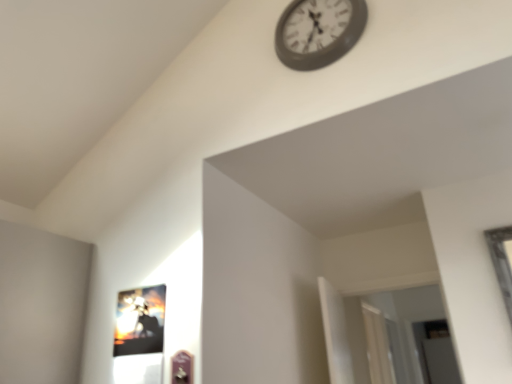
The height and width of the screenshot is (384, 512). What do you see at coordinates (140, 321) in the screenshot?
I see `metallic glossy picture frame at lower left` at bounding box center [140, 321].

At what (x,y) coordinates should I click in order to perform the action: click on metallic glossy picture frame at lower left. Please return your answer as a coordinate pair (x, y). Looking at the image, I should click on (140, 321).

Locate an element on the screen. This screenshot has height=384, width=512. metallic gray clock at upper center is located at coordinates (318, 32).

What do you see at coordinates (318, 32) in the screenshot?
I see `metallic gray clock at upper center` at bounding box center [318, 32].

From the picture: In order to face metallic gray clock at upper center, should I rotate leftwards or rightwards?

Rotate right and turn 8.149 degrees.

Find the location of a particular element. metallic glossy picture frame at lower left is located at coordinates (140, 321).

Which is more to the left, metallic glossy picture frame at lower left or metallic gray clock at upper center?

From the viewer's perspective, metallic glossy picture frame at lower left appears more on the left side.

Considering their positions, is metallic glossy picture frame at lower left located in front of or behind metallic gray clock at upper center?

metallic glossy picture frame at lower left is positioned closer to the viewer than metallic gray clock at upper center.

Which point is more distant from viewer, (123, 343) or (343, 44)?

The point (123, 343) is more distant.

From the image's perspective, is metallic glossy picture frame at lower left positioned above or below metallic gray clock at upper center?

metallic glossy picture frame at lower left is below metallic gray clock at upper center.

From a real-world perspective, is metallic glossy picture frame at lower left positioned over metallic gray clock at upper center based on gravity?

Incorrect, from a real-world perspective, metallic glossy picture frame at lower left is lower than metallic gray clock at upper center.

Can you confirm if metallic glossy picture frame at lower left is wider than metallic gray clock at upper center?

In fact, metallic glossy picture frame at lower left might be narrower than metallic gray clock at upper center.

Considering the relative sizes of metallic glossy picture frame at lower left and metallic gray clock at upper center in the image provided, is metallic glossy picture frame at lower left taller than metallic gray clock at upper center?

No, metallic glossy picture frame at lower left is not taller than metallic gray clock at upper center.

Considering the sizes of objects metallic glossy picture frame at lower left and metallic gray clock at upper center in the image provided, who is bigger, metallic glossy picture frame at lower left or metallic gray clock at upper center?

metallic gray clock at upper center.

Choose the correct answer: Is metallic glossy picture frame at lower left inside metallic gray clock at upper center or outside it?

metallic glossy picture frame at lower left is not enclosed by metallic gray clock at upper center.

In the scene shown: Is metallic glossy picture frame at lower left positioned far away from metallic gray clock at upper center?

Yes, metallic glossy picture frame at lower left is far from metallic gray clock at upper center.

Is metallic glossy picture frame at lower left aimed at metallic gray clock at upper center?

No.

From the picture: Can you tell me how much metallic glossy picture frame at lower left and metallic gray clock at upper center differ in facing direction?

There is a 0.494-degree angle between the facing directions of metallic glossy picture frame at lower left and metallic gray clock at upper center.

This screenshot has height=384, width=512. I want to click on picture frame on the left of the metallic gray clock at upper center, so click(x=140, y=321).

Can you confirm if metallic gray clock at upper center is positioned to the left of metallic glossy picture frame at lower left?

No.

Which is in front, metallic gray clock at upper center or metallic glossy picture frame at lower left?

metallic glossy picture frame at lower left is more forward.

Is point (317, 54) farther from camera compared to point (126, 351)?

Yes, point (317, 54) is behind point (126, 351).

From the image's perspective, which is above, metallic gray clock at upper center or metallic glossy picture frame at lower left?

From the image's view, metallic gray clock at upper center is above.

From a real-world perspective, is metallic gray clock at upper center positioned under metallic glossy picture frame at lower left based on gravity?

No, from a real-world perspective, metallic gray clock at upper center is not under metallic glossy picture frame at lower left.

Based on the photo, which object is wider, metallic gray clock at upper center or metallic glossy picture frame at lower left?

Wider between the two is metallic gray clock at upper center.

Who is taller, metallic gray clock at upper center or metallic glossy picture frame at lower left?

metallic gray clock at upper center.

Between metallic gray clock at upper center and metallic glossy picture frame at lower left, which one has larger size?

Bigger between the two is metallic gray clock at upper center.

Is metallic gray clock at upper center situated inside metallic glossy picture frame at lower left or outside?

metallic gray clock at upper center is outside metallic glossy picture frame at lower left.

Is metallic gray clock at upper center far from metallic glossy picture frame at lower left?

Yes, metallic gray clock at upper center and metallic glossy picture frame at lower left are quite far apart.

Is metallic gray clock at upper center looking in the opposite direction of metallic glossy picture frame at lower left?

metallic gray clock at upper center is not turned away from metallic glossy picture frame at lower left.

Can you tell me how much metallic gray clock at upper center and metallic glossy picture frame at lower left differ in facing direction?

0.494 degrees separate the facing orientations of metallic gray clock at upper center and metallic glossy picture frame at lower left.

Locate an element on the screen. This screenshot has height=384, width=512. wall clock on the right of metallic glossy picture frame at lower left is located at coordinates (318, 32).

The height and width of the screenshot is (384, 512). Find the location of `picture frame located on the left of metallic gray clock at upper center`. picture frame located on the left of metallic gray clock at upper center is located at coordinates (140, 321).

Where is `wall clock that is on the right side of metallic glossy picture frame at lower left`? wall clock that is on the right side of metallic glossy picture frame at lower left is located at coordinates (318, 32).